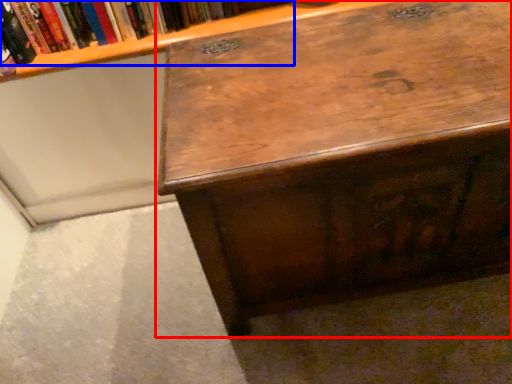
Question: Which of the following is the farthest to the observer, desk (highlighted by a red box) or book (highlighted by a blue box)?

Choices:
 (A) desk
 (B) book

Answer: (B)